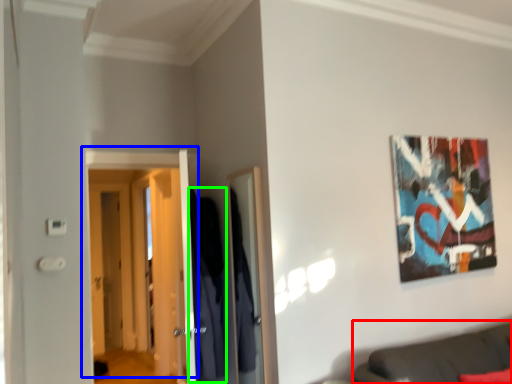
Question: Which is farther away from couch (highlighted by a red box)? door (highlighted by a blue box) or robe (highlighted by a green box)?

Choices:
 (A) door
 (B) robe

Answer: (A)